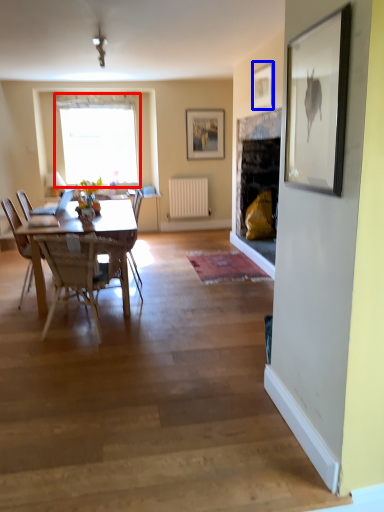
Question: Which object is further to the camera taking this photo, window (highlighted by a red box) or picture frame (highlighted by a blue box)?

Choices:
 (A) window
 (B) picture frame

Answer: (A)